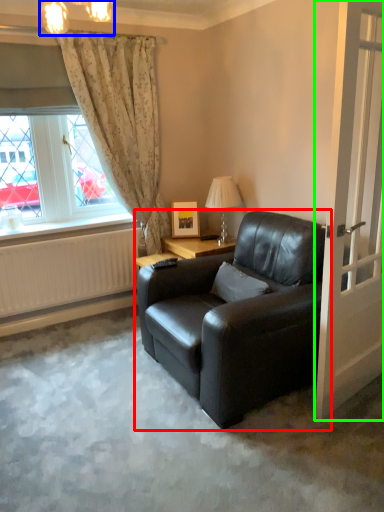
Question: Estimate the real-world distances between objects in this image. Which object is closer to chair (highlighted by a red box), lamp (highlighted by a blue box) or door (highlighted by a green box)?

Choices:
 (A) lamp
 (B) door

Answer: (B)